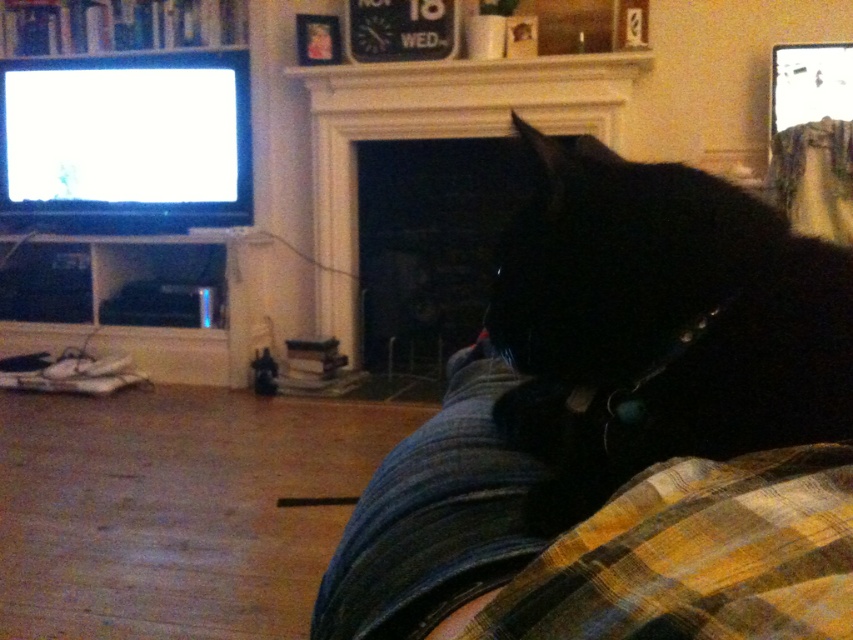
Question: Is plaid fabric at lower right further to the viewer compared to white stone fireplace at center?

Choices:
 (A) no
 (B) yes

Answer: (A)

Question: Considering the real-world distances, which object is closest to the white stone fireplace at center?

Choices:
 (A) black fur cat at lower right
 (B) plaid fabric at lower right

Answer: (A)

Question: Does black fur cat at lower right appear under white stone fireplace at center?

Choices:
 (A) no
 (B) yes

Answer: (B)

Question: Which point is farther to the camera?

Choices:
 (A) white stone fireplace at center
 (B) black fur cat at lower right
 (C) plaid fabric at lower right

Answer: (A)

Question: Which of the following is the closest to the observer?

Choices:
 (A) black fur cat at lower right
 (B) plaid fabric at lower right

Answer: (B)

Question: Can you confirm if plaid fabric at lower right is thinner than white stone fireplace at center?

Choices:
 (A) no
 (B) yes

Answer: (B)